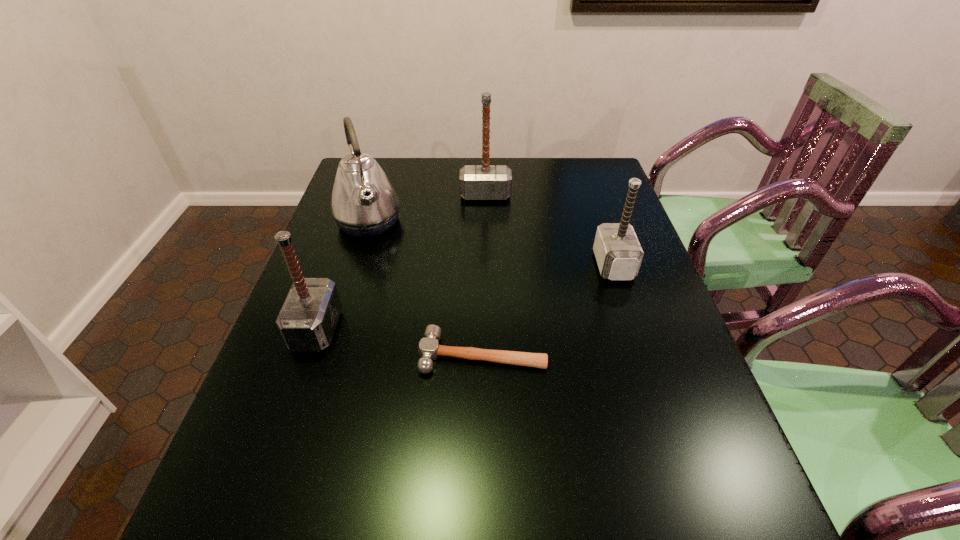
Where is `blank space located for striking with the head of the second farthest hammer`? The image size is (960, 540). blank space located for striking with the head of the second farthest hammer is located at coordinates (482, 265).

Locate an element on the screen. This screenshot has width=960, height=540. vacant space located 0.360m for striking with the head of the second farthest hammer is located at coordinates (464, 265).

Locate an element on the screen. The width and height of the screenshot is (960, 540). vacant space situated 0.250m on the left of the shortest object is located at coordinates (307, 355).

Where is `object positioned at the far edge`? object positioned at the far edge is located at coordinates (481, 182).

At what (x,y) coordinates should I click in order to perform the action: click on kettle present at the left edge. Please return your answer as a coordinate pair (x, y). The height and width of the screenshot is (540, 960). Looking at the image, I should click on (364, 203).

Identify the location of hammer located in the left edge section of the desktop. The height and width of the screenshot is (540, 960). (307, 321).

The height and width of the screenshot is (540, 960). I want to click on object present at the right edge, so click(618, 253).

Identify the location of vacant space at the far edge. (443, 187).

Where is `blank area at the right edge`? This screenshot has width=960, height=540. blank area at the right edge is located at coordinates point(681,470).

Identify the location of free space at the far right corner. The height and width of the screenshot is (540, 960). (611, 176).